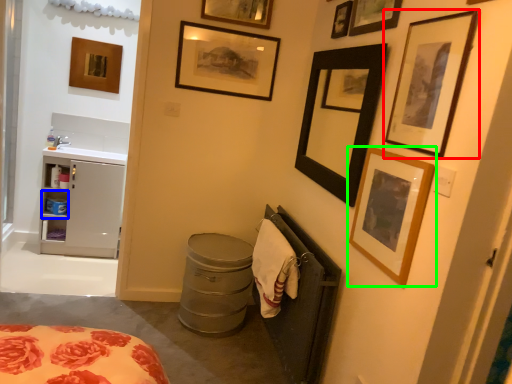
Question: Which object is the closest to the picture frame (highlighted by a red box)? Choose among these: cabinet (highlighted by a blue box) or picture frame (highlighted by a green box).

Choices:
 (A) cabinet
 (B) picture frame

Answer: (B)